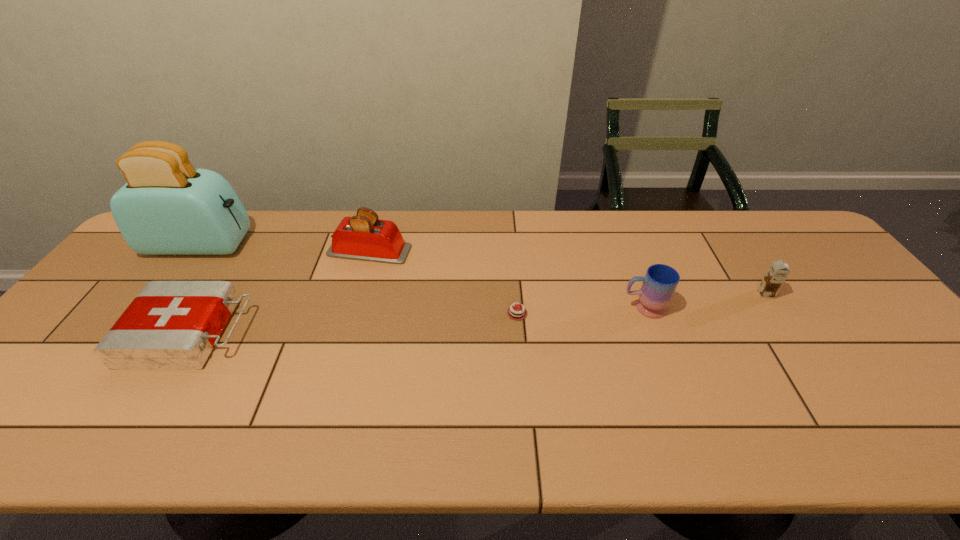
I want to click on the taller toaster, so click(x=167, y=207).

The height and width of the screenshot is (540, 960). In order to click on the tallest object in this screenshot , I will do point(167,207).

I want to click on the shorter toaster, so click(364, 237).

At what (x,y) coordinates should I click in order to perform the action: click on the right toaster. Please return your answer as a coordinate pair (x, y). Image resolution: width=960 pixels, height=540 pixels. Looking at the image, I should click on (364, 237).

At what (x,y) coordinates should I click in order to perform the action: click on mug. Please return your answer as a coordinate pair (x, y). The height and width of the screenshot is (540, 960). Looking at the image, I should click on pyautogui.click(x=660, y=282).

This screenshot has width=960, height=540. What are the coordinates of `the rightmost object` in the screenshot? It's located at (778, 272).

You are a GUI agent. You are given a task and a screenshot of the screen. Output one action in this format:
    pyautogui.click(x=<x>, y=<y>)
    Task: Click on the first-aid kit
    This screenshot has width=960, height=540.
    Given the screenshot: What is the action you would take?
    pyautogui.click(x=170, y=325)

This screenshot has height=540, width=960. Identify the location of chocolate cake. (515, 313).

The width and height of the screenshot is (960, 540). What are the coordinates of `the shortest object` in the screenshot? It's located at (515, 313).

This screenshot has width=960, height=540. Find the location of `blank space located on the side of the tallest object with the lever`. blank space located on the side of the tallest object with the lever is located at coordinates (334, 245).